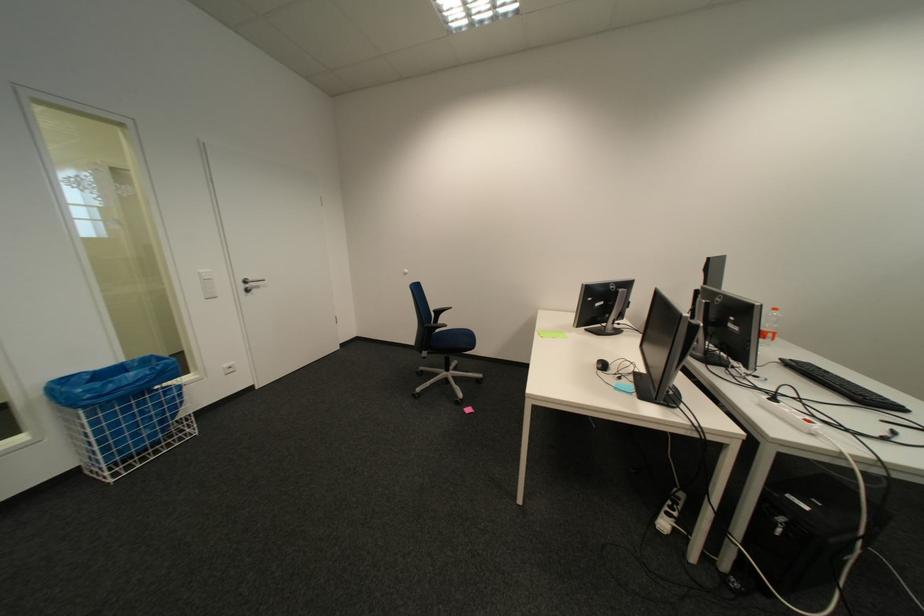
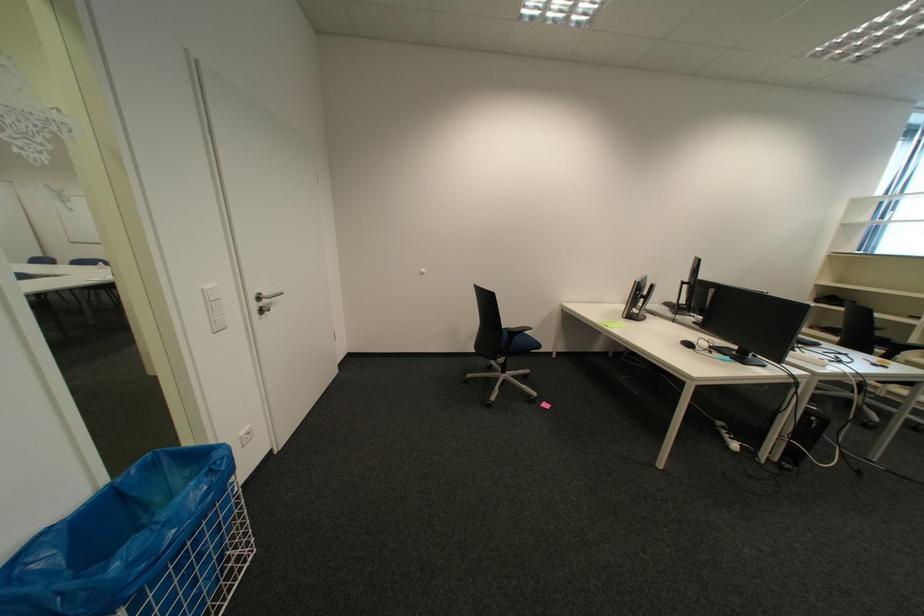
The point at (213, 272) is marked in the first image. Where is the corresponding point in the second image?

(217, 288)